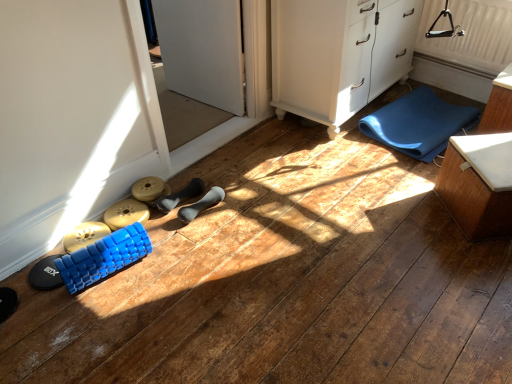
Question: In terms of width, does blue foam roller at lower left, which ranks as the 1th toy in front-to-back order, look wider or thinner when compared to black rubber shoe at center, acting as the 4th footwear starting from the left?

Choices:
 (A) thin
 (B) wide

Answer: (B)

Question: Is blue foam roller at lower left, the 2th toy when ordered from back to front, taller or shorter than black rubber shoe at center, acting as the 4th footwear starting from the left?

Choices:
 (A) tall
 (B) short

Answer: (A)

Question: Which object is the closest to the blue foam roller at lower left, the 2th toy when ordered from back to front?

Choices:
 (A) white textured radiator at upper right
 (B) black fuzzy slipper at lower left, arranged as the first footwear when viewed from the left
 (C) white textured box at right
 (D) matte gray dumbbell at center, acting as the third footwear starting from the left
 (E) black rubber shoe at center, acting as the 4th footwear starting from the left

Answer: (B)

Question: Considering the real-world distances, which object is closest to the white textured box at right?

Choices:
 (A) white glossy door at center
 (B) black rubber shoe at center, placed as the 1th footwear when sorted from right to left
 (C) blue textured foam roller at lower left, which ranks as the second toy in front-to-back order
 (D) white textured radiator at upper right
 (E) black fuzzy slipper at lower left, arranged as the first footwear when viewed from the left

Answer: (D)